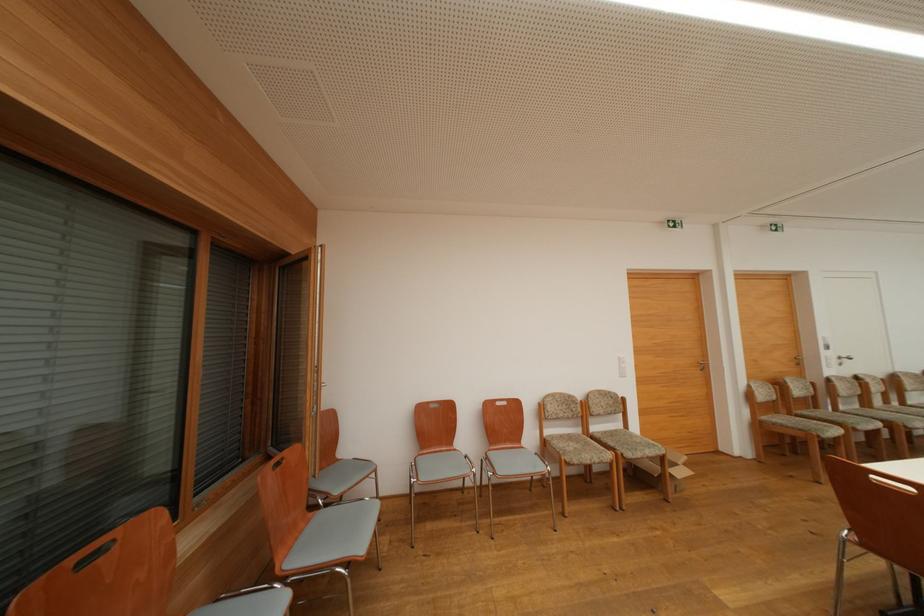
Where would you pull the silver window handle? Please return your answer as a coordinate pair (x, y).

(843, 359)